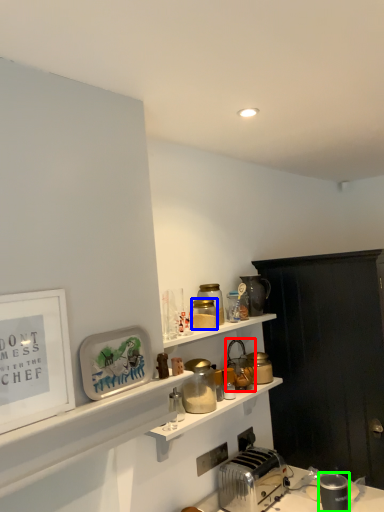
Question: Which object is positioned closest to appliance (highlighted by a red box)? Select from appliance (highlighted by a blue box) and appliance (highlighted by a green box).

Choices:
 (A) appliance
 (B) appliance

Answer: (A)